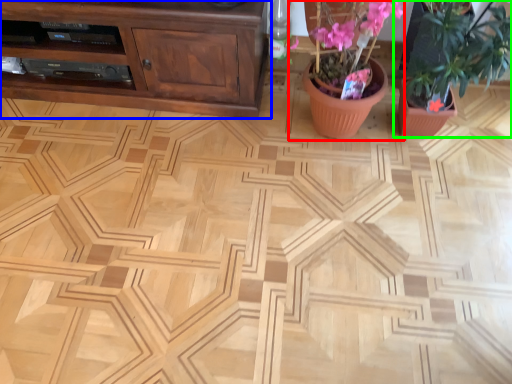
Question: Which object is the closest to the floral arrangement (highlighted by a red box)? Choose among these: cabinetry (highlighted by a blue box) or houseplant (highlighted by a green box).

Choices:
 (A) cabinetry
 (B) houseplant

Answer: (B)